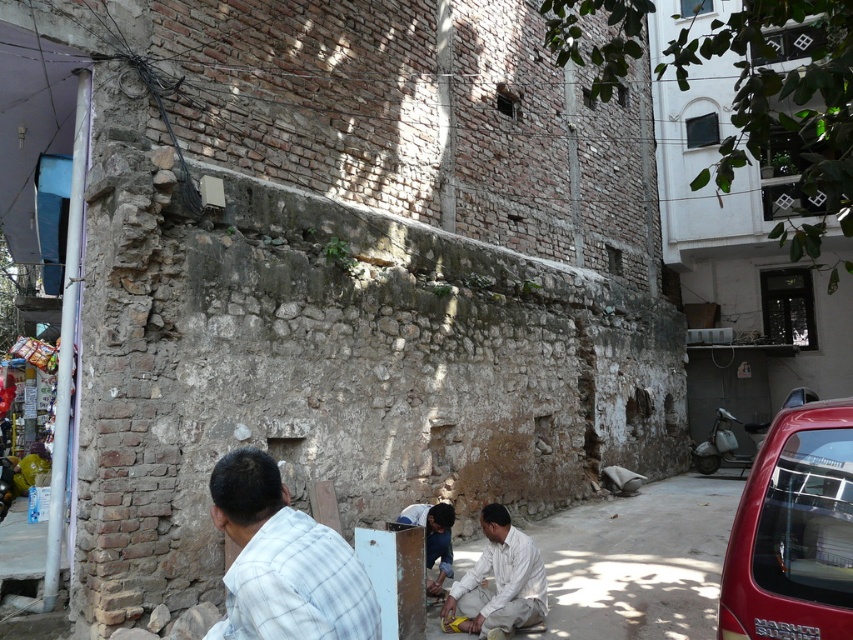
You are standing at the center of the image and want to locate the white checkered shirt at lower left. In which direction should you look relative to your current position?

The white checkered shirt at lower left is located at point (283, 561), which means it is positioned to the lower left of your current position. You should look downward and to the left to find it.

You are a delivery person who needs to park your delivery van, which is 3 meters long, near the shiny red car at lower right. The parking spot you found has a maximum length of 2.5 meters. Can you fit your van in this spot?

The position of shiny red car at lower right is at point (793, 531). Since the parking spot has a maximum length of 2.5 meters and your van is 3 meters long, it cannot fit in the spot.

You are standing in front of the brick wall and notice two points marked on the ground. The first point is at coordinates point [316,628] and the second is at point [497,525]. If you want to place a small object closer to the camera, which point should you choose?

You should choose point [316,628] because it is closer to the camera than point [497,525].